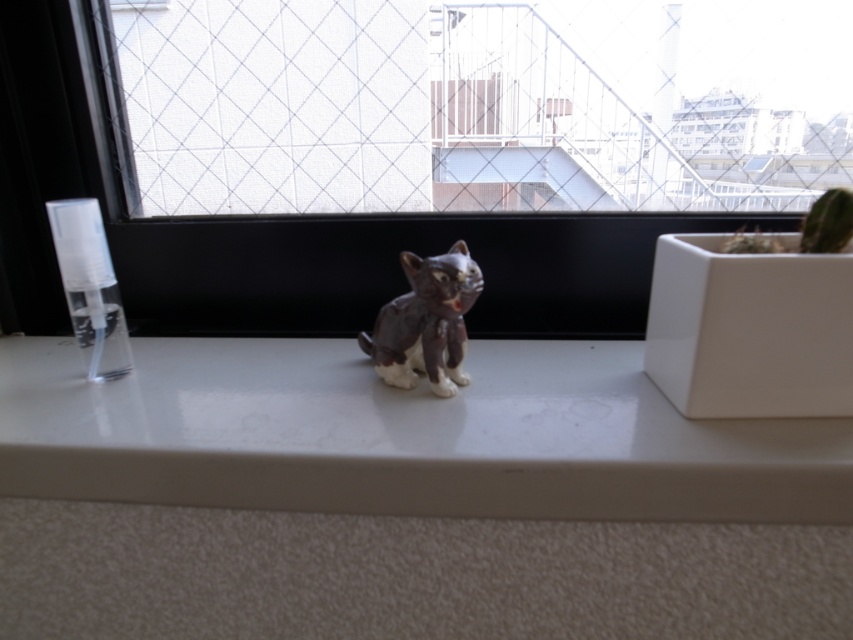
Does point (624, 168) come in front of point (344, 365)?

No.

Between transparent mesh at center and white glossy counter top at center, which one appears on the right side from the viewer's perspective?

transparent mesh at center is more to the right.

Who is more distant from viewer, (x=326, y=211) or (x=439, y=468)?

Positioned behind is point (x=326, y=211).

Find the location of `transparent mesh at center`. transparent mesh at center is located at coordinates (457, 109).

Can you confirm if transparent mesh at center is positioned above matte brown cat at center?

Yes.

Who is taller, transparent mesh at center or matte brown cat at center?

Standing taller between the two is transparent mesh at center.

Identify the location of transparent mesh at center. The width and height of the screenshot is (853, 640). (457, 109).

This screenshot has height=640, width=853. I want to click on transparent mesh at center, so click(457, 109).

What do you see at coordinates (402, 435) in the screenshot? I see `white glossy counter top at center` at bounding box center [402, 435].

Is white glossy counter top at center smaller than matte brown cat at center?

No, white glossy counter top at center is not smaller than matte brown cat at center.

The height and width of the screenshot is (640, 853). What do you see at coordinates (402, 435) in the screenshot? I see `white glossy counter top at center` at bounding box center [402, 435].

I want to click on white glossy counter top at center, so click(402, 435).